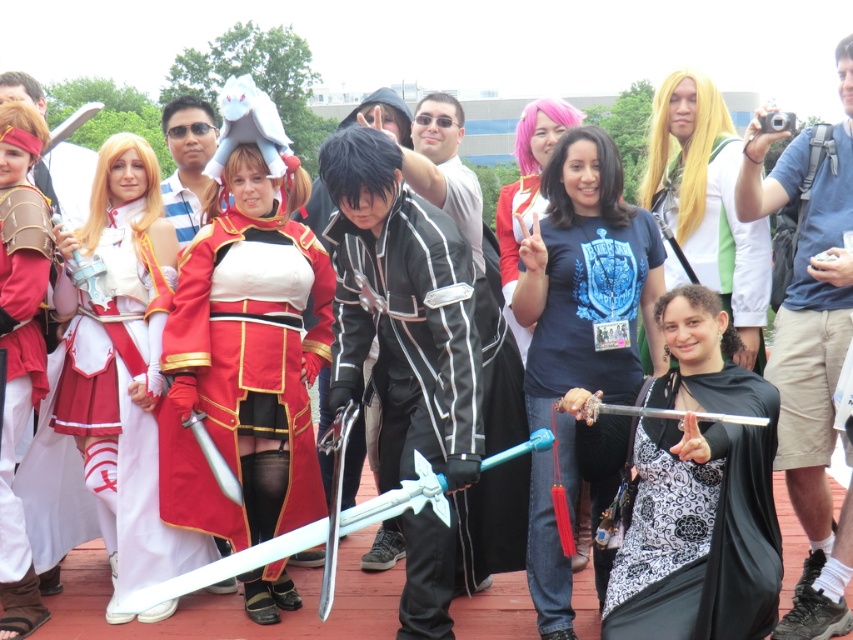
Question: Does shiny red fabric dress at center lie behind blue denim shorts at lower right?

Choices:
 (A) no
 (B) yes

Answer: (B)

Question: Which object is the closest to the green fabric dress at center?

Choices:
 (A) black matte sword at center
 (B) black satin cape at center

Answer: (B)

Question: Which point is farther to the camera?

Choices:
 (A) (699, 244)
 (B) (202, 124)
 (C) (556, 244)

Answer: (B)

Question: Is blue denim shorts at lower right further to the viewer compared to green fabric dress at center?

Choices:
 (A) yes
 (B) no

Answer: (B)

Question: Which of the following is the farthest from the observer?

Choices:
 (A) shiny red fabric dress at center
 (B) black matte sword at center

Answer: (A)

Question: Does black satin cape at center appear over green fabric dress at center?

Choices:
 (A) no
 (B) yes

Answer: (A)